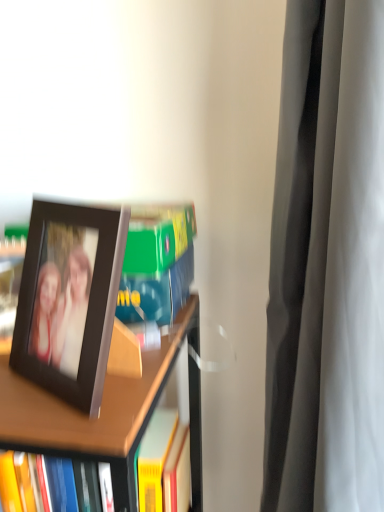
Question: Based on their positions, is brown wooden bookcase at left located to the left or right of black plastic picture frame at left?

Choices:
 (A) right
 (B) left

Answer: (B)

Question: Considering the positions of point (59, 422) and point (104, 212), is point (59, 422) closer or farther from the camera than point (104, 212)?

Choices:
 (A) closer
 (B) farther

Answer: (A)

Question: Considering their positions, is brown wooden bookcase at left located in front of or behind black plastic picture frame at left?

Choices:
 (A) front
 (B) behind

Answer: (B)

Question: Considering the positions of black plastic picture frame at left and brown wooden bookcase at left in the image, is black plastic picture frame at left wider or thinner than brown wooden bookcase at left?

Choices:
 (A) thin
 (B) wide

Answer: (A)

Question: Is black plastic picture frame at left bigger or smaller than brown wooden bookcase at left?

Choices:
 (A) small
 (B) big

Answer: (A)

Question: From a real-world perspective, is black plastic picture frame at left positioned above or below brown wooden bookcase at left?

Choices:
 (A) above
 (B) below

Answer: (A)

Question: Does point (117, 265) appear closer or farther from the camera than point (155, 387)?

Choices:
 (A) closer
 (B) farther

Answer: (A)